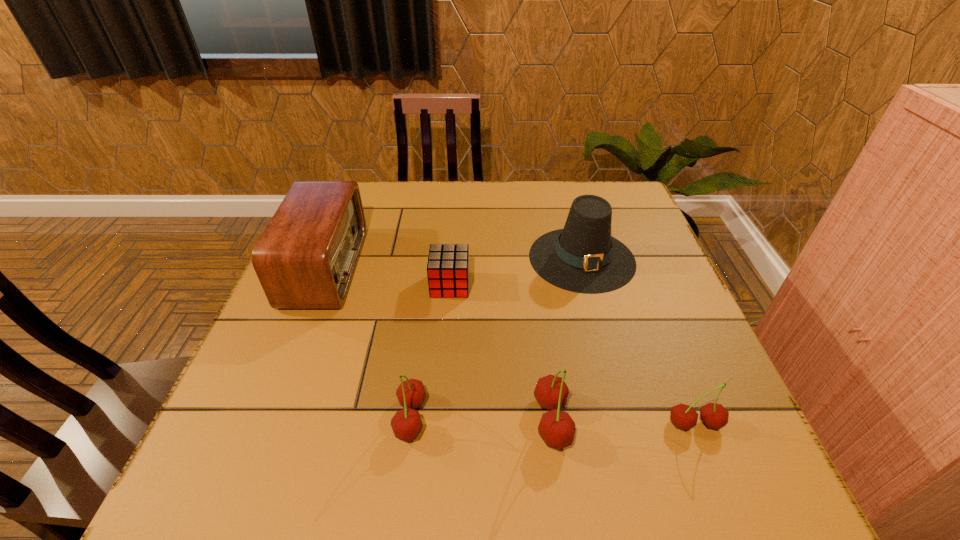
Image resolution: width=960 pixels, height=540 pixels. I want to click on the second shortest cherry, so click(x=406, y=424).

Where is `the second cherry from left to right`? This screenshot has width=960, height=540. the second cherry from left to right is located at coordinates (557, 429).

Locate an element on the screen. Image resolution: width=960 pixels, height=540 pixels. the rightmost cherry is located at coordinates (713, 415).

Where is `the shortest cherry`? The width and height of the screenshot is (960, 540). the shortest cherry is located at coordinates tap(713, 415).

This screenshot has width=960, height=540. In order to click on hat in this screenshot , I will do `click(583, 257)`.

What are the coordinates of `radio receiver` in the screenshot? It's located at (305, 259).

The width and height of the screenshot is (960, 540). Identify the location of the shortest object. (448, 264).

Where is `vacant space situated 0.080m on the surface of the leftmost cherry`? vacant space situated 0.080m on the surface of the leftmost cherry is located at coordinates (352, 418).

Where is `vacant space located 0.130m on the surface of the leftmost cherry`? The width and height of the screenshot is (960, 540). vacant space located 0.130m on the surface of the leftmost cherry is located at coordinates (325, 418).

You are a GUI agent. You are given a task and a screenshot of the screen. Output one action in this format:
    pyautogui.click(x=<x>, y=<y>)
    Task: Click on the free space located 0.110m on the surface of the leftmost cherry
    The height and width of the screenshot is (540, 960).
    Given the screenshot: What is the action you would take?
    pyautogui.click(x=336, y=418)